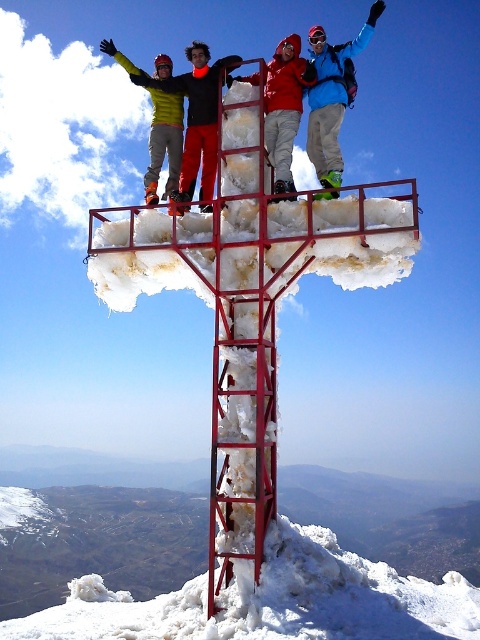
Question: Does white frosty snow at lower center have a smaller size compared to yellow-green jacket at upper left?

Choices:
 (A) yes
 (B) no

Answer: (A)

Question: Can you confirm if red metal cross at center is positioned below matte red jacket at center?

Choices:
 (A) no
 (B) yes

Answer: (B)

Question: Does yellow-green ski suit at upper left lie behind matte red jacket at center?

Choices:
 (A) no
 (B) yes

Answer: (B)

Question: Which object appears farthest from the camera in this image?

Choices:
 (A) yellow-green ski suit at upper left
 (B) white frosty snow at lower center
 (C) matte red jacket at center
 (D) red metal cross at center

Answer: (A)

Question: Which of these objects is positioned farthest from the yellow-green jacket at upper left?

Choices:
 (A) red metal cross at center
 (B) matte red jacket at center
 (C) yellow-green ski suit at upper left
 (D) white frosty snow at lower center

Answer: (D)

Question: Which is farther from the white frosty snow at lower center?

Choices:
 (A) matte red jacket at center
 (B) yellow-green ski suit at upper left
 (C) yellow-green jacket at upper left
 (D) red metal cross at center

Answer: (C)